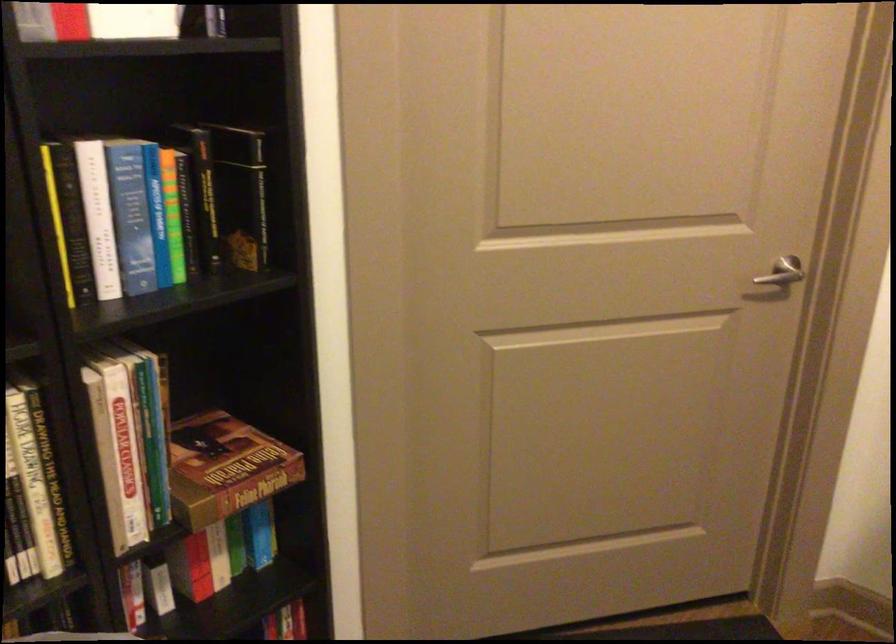
Where is `silver door handle`? The width and height of the screenshot is (896, 644). silver door handle is located at coordinates (781, 272).